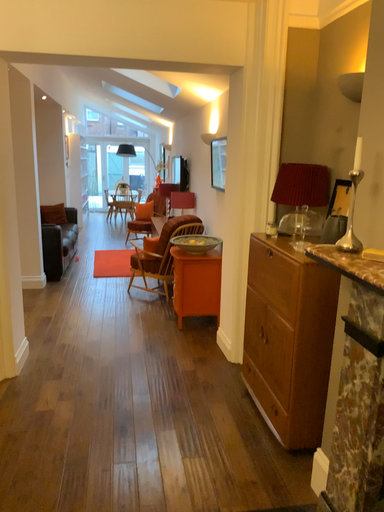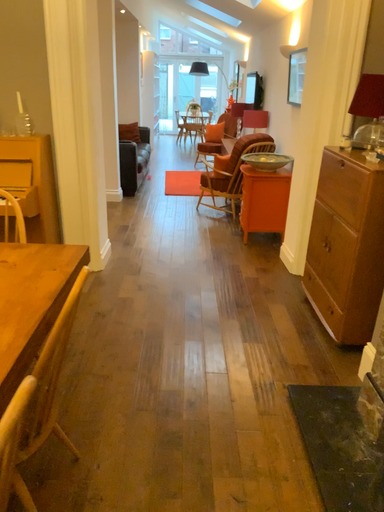
Question: Which way did the camera rotate in the video?

Choices:
 (A) rotated right
 (B) rotated left

Answer: (B)